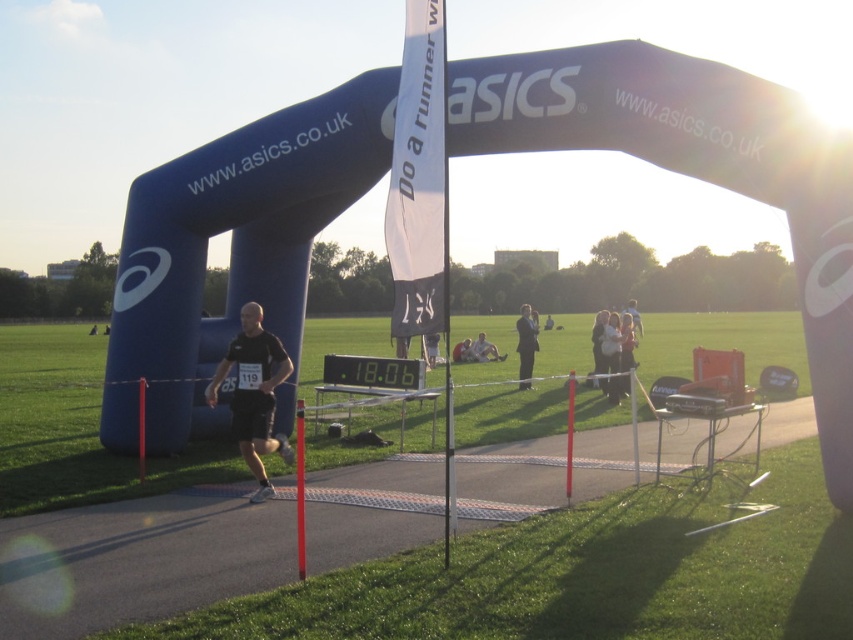
Does smooth plastic pole at center appear on the right side of light brown leather jacket at upper center?

Incorrect, smooth plastic pole at center is not on the right side of light brown leather jacket at upper center.

Which of these two, smooth plastic pole at center or light brown leather jacket at upper center, stands shorter?

Standing shorter between the two is smooth plastic pole at center.

Which is in front, point (572, 404) or point (625, 308)?

Point (572, 404) is more forward.

Where is `smooth plastic pole at center`? This screenshot has height=640, width=853. smooth plastic pole at center is located at coordinates pyautogui.click(x=569, y=435).

Is metallic silver pole at center further to camera compared to dark gray suit at center?

No.

The width and height of the screenshot is (853, 640). I want to click on metallic silver pole at center, so click(300, 490).

Image resolution: width=853 pixels, height=640 pixels. I want to click on metallic silver pole at center, so click(x=300, y=490).

Who is higher up, dark gray suit at center or smooth plastic pole at center?

dark gray suit at center

Between point (527, 307) and point (570, 408), which one is positioned behind?

The point (527, 307) is more distant.

Does point (517, 332) lie in front of point (567, 429)?

No, (517, 332) is behind (567, 429).

Locate an element on the screen. dark gray suit at center is located at coordinates (526, 344).